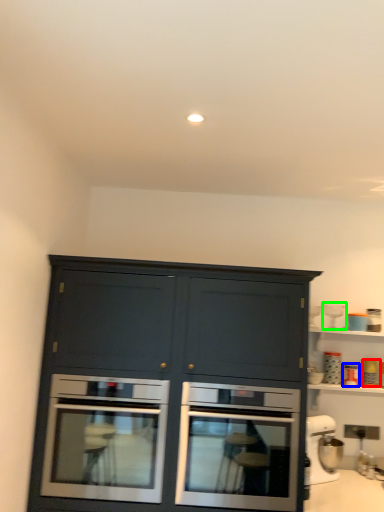
Question: Estimate the real-world distances between objects in this image. Which object is closer to appliance (highlighted by a red box), appliance (highlighted by a blue box) or appliance (highlighted by a green box)?

Choices:
 (A) appliance
 (B) appliance

Answer: (A)